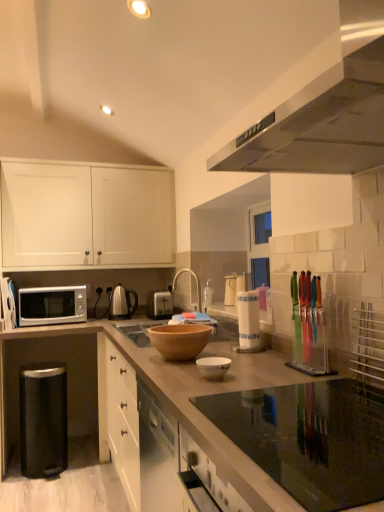
Measure the distance between point (200, 308) and camera.

They are 8.05 feet apart.

Identify the location of brown matte mixing bowl at center. The image size is (384, 512). (180, 340).

The width and height of the screenshot is (384, 512). What are the coordinates of `black matte trash can at lower left` in the screenshot? It's located at (43, 419).

The height and width of the screenshot is (512, 384). I want to click on transparent plastic knife block at right, arranged as the 2th appliance when viewed from the right, so click(310, 331).

What do you see at coordinates (180, 401) in the screenshot? I see `brown matte bowl at center` at bounding box center [180, 401].

You are a GUI agent. You are given a task and a screenshot of the screen. Output one action in this format:
    pyautogui.click(x=<x>, y=<y>)
    Task: Click on the satin nickel tea kettle at center
    This screenshot has width=384, height=512.
    Given the screenshot: What is the action you would take?
    pyautogui.click(x=121, y=302)

The height and width of the screenshot is (512, 384). What are the coordinates of `silver metallic faucet at center` in the screenshot? It's located at (196, 283).

Between brown matte bowl at center and white matte cabinet at upper left, which one has smaller width?

white matte cabinet at upper left.

From a real-world perspective, which is physically above, brown matte bowl at center or white matte cabinet at upper left?

In real-world perspective, white matte cabinet at upper left is above.

How different are the orientations of brown matte bowl at center and white matte cabinet at upper left in degrees?

brown matte bowl at center and white matte cabinet at upper left are facing 91.9 degrees away from each other.

Is brown matte bowl at center not near silver metallic microwave at lower left?

Yes, brown matte bowl at center is far from silver metallic microwave at lower left.

Is brown matte bowl at center further to camera compared to silver metallic microwave at lower left?

No, it is in front of silver metallic microwave at lower left.

Is brown matte bowl at center facing towards silver metallic microwave at lower left?

No, brown matte bowl at center is not turned towards silver metallic microwave at lower left.

Is brown matte bowl at center not inside silver metallic microwave at lower left?

Yes.

Consider the image. In the image, is brown wooden bowl at center on the left side or the right side of silver metallic microwave at left, which ranks as the 4th appliance in front-to-back order?

Based on their positions, brown wooden bowl at center is located to the right of silver metallic microwave at left, which ranks as the 4th appliance in front-to-back order.

Is brown wooden bowl at center positioned with its back to silver metallic microwave at left, marked as the first appliance in a left-to-right arrangement?

brown wooden bowl at center is not turned away from silver metallic microwave at left, marked as the first appliance in a left-to-right arrangement.

Is the surface of brown wooden bowl at center in direct contact with silver metallic microwave at left, the 2th appliance from the back?

brown wooden bowl at center and silver metallic microwave at left, the 2th appliance from the back, are clearly separated.

Does brown wooden bowl at center have a smaller size compared to silver metallic microwave at left, the 2th appliance from the back?

Yes.

From a real-world perspective, is silver metallic microwave at left, which ranks as the 4th appliance in front-to-back order, physically located above or below black matte trash can at lower left?

In terms of real-world spatial position, silver metallic microwave at left, which ranks as the 4th appliance in front-to-back order, is above black matte trash can at lower left.

Is silver metallic microwave at left, marked as the first appliance in a left-to-right arrangement, bigger or smaller than black matte trash can at lower left?

In the image, silver metallic microwave at left, marked as the first appliance in a left-to-right arrangement, appears to be smaller than black matte trash can at lower left.

Identify the location of the 2nd appliance behind the black matte trash can at lower left. (8, 303).

Which is nearer, (2, 291) or (64, 407)?

The point (2, 291) is more forward.

Which object is closer to the camera, brown wooden bowl at center or stainless steel range hood at upper center?

stainless steel range hood at upper center is closer to the camera.

Is there a large distance between brown wooden bowl at center and stainless steel range hood at upper center?

Absolutely, brown wooden bowl at center is distant from stainless steel range hood at upper center.

Is brown wooden bowl at center oriented towards stainless steel range hood at upper center?

No, brown wooden bowl at center is not turned towards stainless steel range hood at upper center.

From their relative heights in the image, would you say brown wooden bowl at center is taller or shorter than stainless steel range hood at upper center?

Clearly, brown wooden bowl at center is shorter compared to stainless steel range hood at upper center.

Are white matte cabinet at upper left and brown matte bowl at center far apart?

white matte cabinet at upper left is far away from brown matte bowl at center.

Can you confirm if white matte cabinet at upper left is thinner than brown matte bowl at center?

Indeed, white matte cabinet at upper left has a lesser width compared to brown matte bowl at center.

Is white matte cabinet at upper left oriented away from brown matte bowl at center?

No, white matte cabinet at upper left is not facing the opposite direction of brown matte bowl at center.

Does brown matte mixing bowl at center lie in front of white paper towel holder at center, the 3th appliance in the left-to-right sequence?

Yes, brown matte mixing bowl at center is closer to the camera.

In the scene shown: From the image's perspective, which object appears higher, brown matte mixing bowl at center or white paper towel holder at center, arranged as the 3th appliance when viewed from the right?

white paper towel holder at center, arranged as the 3th appliance when viewed from the right, is shown above in the image.

Is the surface of brown matte mixing bowl at center in direct contact with white paper towel holder at center, which is the 3th appliance from back to front?

No, brown matte mixing bowl at center is not touching white paper towel holder at center, which is the 3th appliance from back to front.

Identify the location of countertop on the right of white matte cabinet at upper left. This screenshot has width=384, height=512. (180, 401).

Where is `countertop that appears below the silver metallic microwave at lower left (from a real-world perspective)`? countertop that appears below the silver metallic microwave at lower left (from a real-world perspective) is located at coordinates (180, 401).

Considering their positions, is white paper towel holder at center, arranged as the 3th appliance when viewed from the right, positioned closer to brown matte mixing bowl at center than black matte trash can at lower left?

Based on the image, white paper towel holder at center, arranged as the 3th appliance when viewed from the right, appears to be nearer to brown matte mixing bowl at center.

Based on their spatial positions, is white glossy bowl at center or black matte trash can at lower left further from satin nickel tea kettle at center?

white glossy bowl at center.

Based on their spatial positions, is silver metallic microwave at left, marked as the fifth appliance in a right-to-left arrangement, or brown matte mixing bowl at center closer to white glossy bowl at center?

The object closer to white glossy bowl at center is brown matte mixing bowl at center.

Looking at the image, which one is located closer to stainless steel range hood at upper center, white matte cabinet at upper left or clear plastic knife block at right, marked as the first appliance in a front-to-back arrangement?

clear plastic knife block at right, marked as the first appliance in a front-to-back arrangement.

When comparing their distances from satin nickel tea kettle at center, does silver metallic toaster at center, the 5th appliance viewed from the front, or brown matte mixing bowl at center seem further?

brown matte mixing bowl at center is further to satin nickel tea kettle at center.

Considering their positions, is black matte trash can at lower left positioned further to clear plastic knife block at right, the first appliance positioned from the right, than white paper towel holder at center, the third appliance in the front-to-back sequence?

Based on the image, black matte trash can at lower left appears to be further to clear plastic knife block at right, the first appliance positioned from the right.

Based on their spatial positions, is brown wooden bowl at center or transparent plastic knife block at right, the fourth appliance viewed from the back, further from black matte trash can at lower left?

transparent plastic knife block at right, the fourth appliance viewed from the back, lies further to black matte trash can at lower left than the other object.

Estimate the real-world distances between objects in this image. Which object is further from black glass cooktop at lower center, white paper towel holder at center, which is the 3th appliance from back to front, or brown wooden bowl at center?

The object further to black glass cooktop at lower center is white paper towel holder at center, which is the 3th appliance from back to front.

Where is `sink between stainless steel range hood at upper center and silver metallic microwave at left, the 2th appliance from the back, from front to back`? sink between stainless steel range hood at upper center and silver metallic microwave at left, the 2th appliance from the back, from front to back is located at coordinates (138, 332).

Locate an element on the screen. The image size is (384, 512). cabinetry between stainless steel range hood at upper center and silver metallic toaster at center, the 5th appliance viewed from the front, in the front-back direction is located at coordinates (85, 215).

I want to click on countertop located between clear plastic knife block at right, the fifth appliance viewed from the back, and silver metallic microwave at lower left in the depth direction, so click(180, 401).

Locate an element on the screen. sink positioned between black glass cooktop at lower center and white matte cabinet at upper left from near to far is located at coordinates (138, 332).